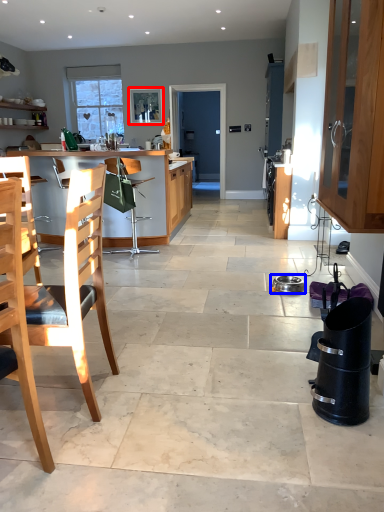
Question: Which point is further to the camera, picture frame (highlighted by a red box) or appliance (highlighted by a blue box)?

Choices:
 (A) picture frame
 (B) appliance

Answer: (A)